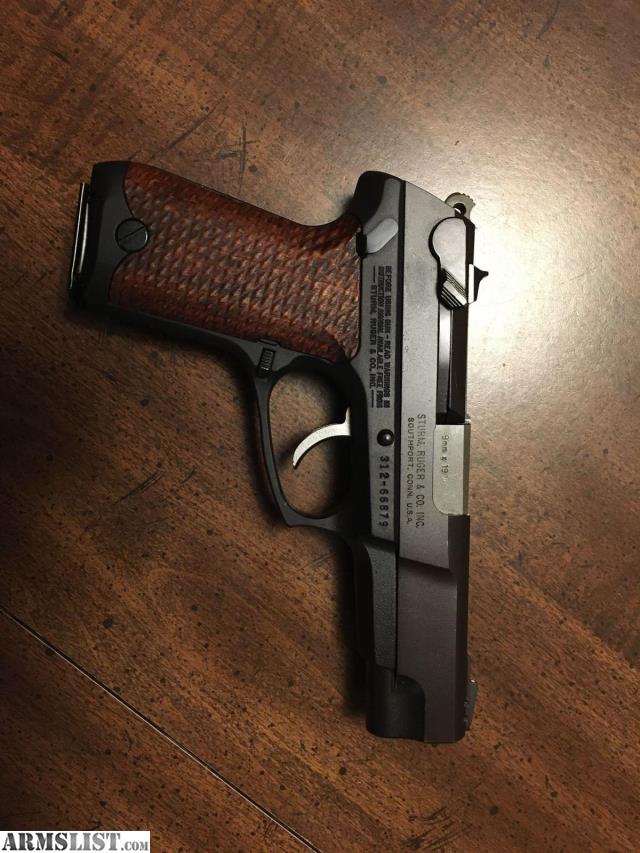
This screenshot has width=640, height=853. I want to click on magazine, so click(76, 258).